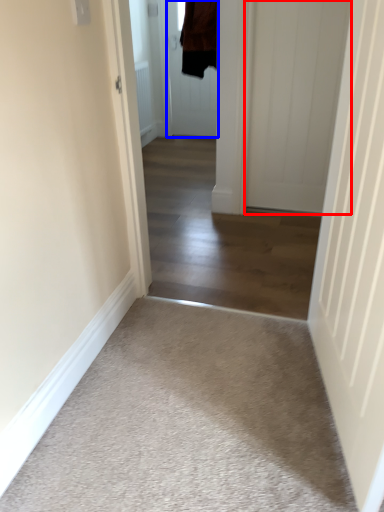
Question: Which point is closer to the camera, door (highlighted by a red box) or door (highlighted by a blue box)?

Choices:
 (A) door
 (B) door

Answer: (A)